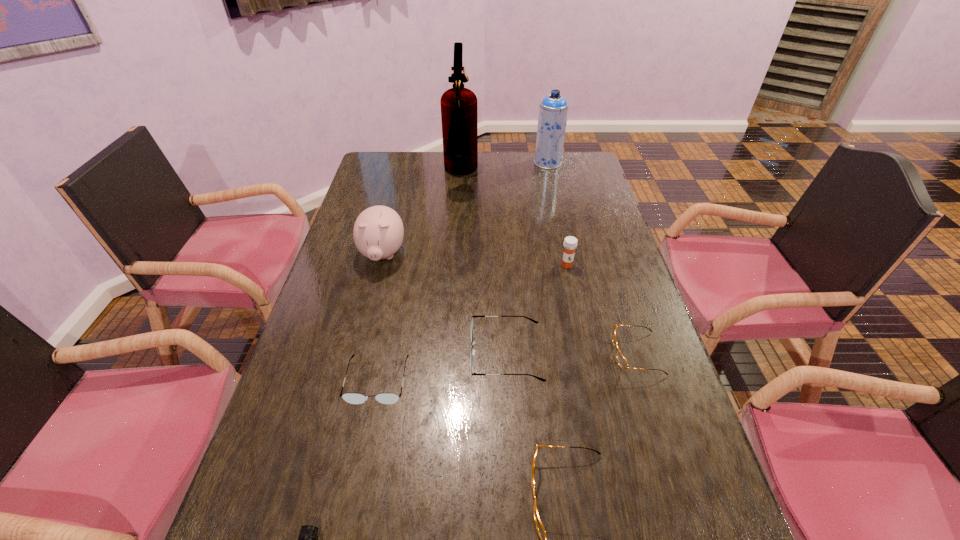
Locate an element on the screen. The height and width of the screenshot is (540, 960). the third closest spectacles to the right gold spectacles is located at coordinates (353, 398).

The image size is (960, 540). In order to click on vacant space that satisfies the following two spatial constraints: 1. on the front-facing side of the smaller gold spectacles; 2. on the lenses of the left black spectacles in this screenshot , I will do `click(645, 380)`.